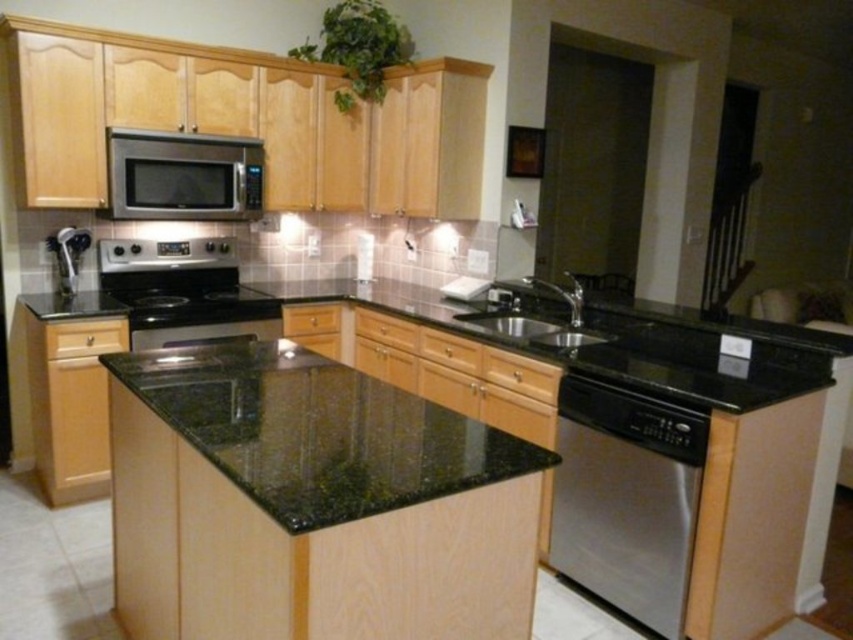
Is satin stainless steel dishwasher at lower right above satin black stove at center?

Incorrect, satin stainless steel dishwasher at lower right is not positioned above satin black stove at center.

Is satin stainless steel dishwasher at lower right thinner than satin black stove at center?

Correct, satin stainless steel dishwasher at lower right's width is less than satin black stove at center's.

Is point (589, 477) less distant than point (117, 291)?

Yes, it is in front of point (117, 291).

Identify the location of satin stainless steel dishwasher at lower right. This screenshot has height=640, width=853. (625, 499).

Between satin stainless steel dishwasher at lower right and satin black oven at center, which one has more height?

With more height is satin stainless steel dishwasher at lower right.

Is point (625, 580) more distant than point (161, 337)?

No, it is not.

Who is more forward, (671, 589) or (177, 342)?

Point (671, 589)

Identify the location of satin stainless steel dishwasher at lower right. (625, 499).

Which is above, satin stainless steel dishwasher at lower right or black granite sink at center?

black granite sink at center

Is satin stainless steel dishwasher at lower right thinner than black granite sink at center?

Indeed, satin stainless steel dishwasher at lower right has a lesser width compared to black granite sink at center.

This screenshot has height=640, width=853. I want to click on satin stainless steel dishwasher at lower right, so click(625, 499).

Find the location of a particular element. This screenshot has width=853, height=640. satin stainless steel dishwasher at lower right is located at coordinates point(625,499).